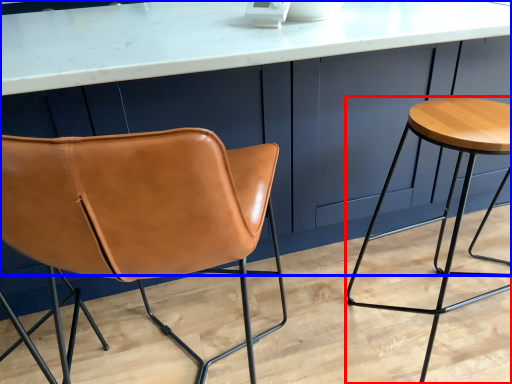
Question: Which point is further to the camera, stool (highlighted by a red box) or counter (highlighted by a blue box)?

Choices:
 (A) stool
 (B) counter

Answer: (A)